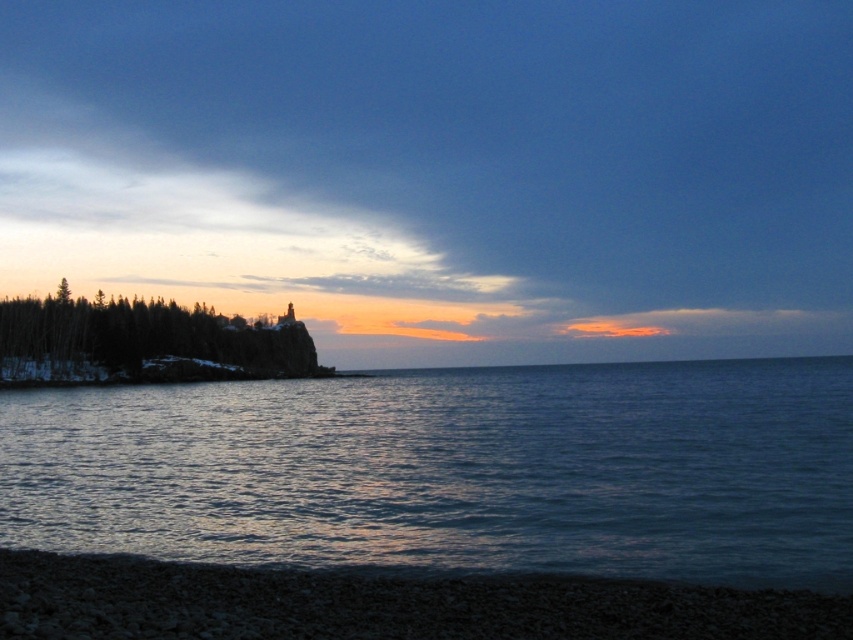
Question: Is blue water at center positioned before green matte trees at left?

Choices:
 (A) no
 (B) yes

Answer: (B)

Question: Is blue water at center to the left of green matte trees at left from the viewer's perspective?

Choices:
 (A) yes
 (B) no

Answer: (B)

Question: Which point is farther to the camera?

Choices:
 (A) (100, 317)
 (B) (223, 387)

Answer: (A)

Question: Does blue water at center have a smaller size compared to green matte trees at left?

Choices:
 (A) yes
 (B) no

Answer: (B)

Question: Which object appears closest to the camera in this image?

Choices:
 (A) green matte trees at left
 (B) blue water at center

Answer: (B)